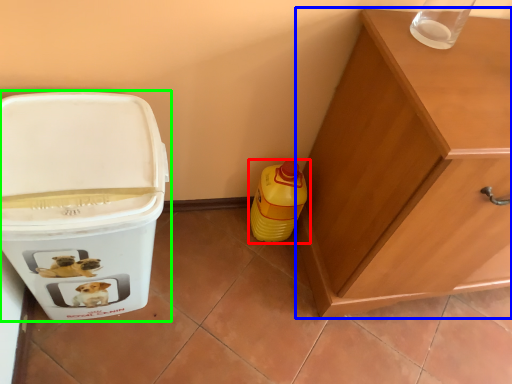
Question: Based on their relative distances, which object is nearer to bottle (highlighted by a red box)? Choose from cabinetry (highlighted by a blue box) and waste container (highlighted by a green box).

Choices:
 (A) cabinetry
 (B) waste container

Answer: (A)